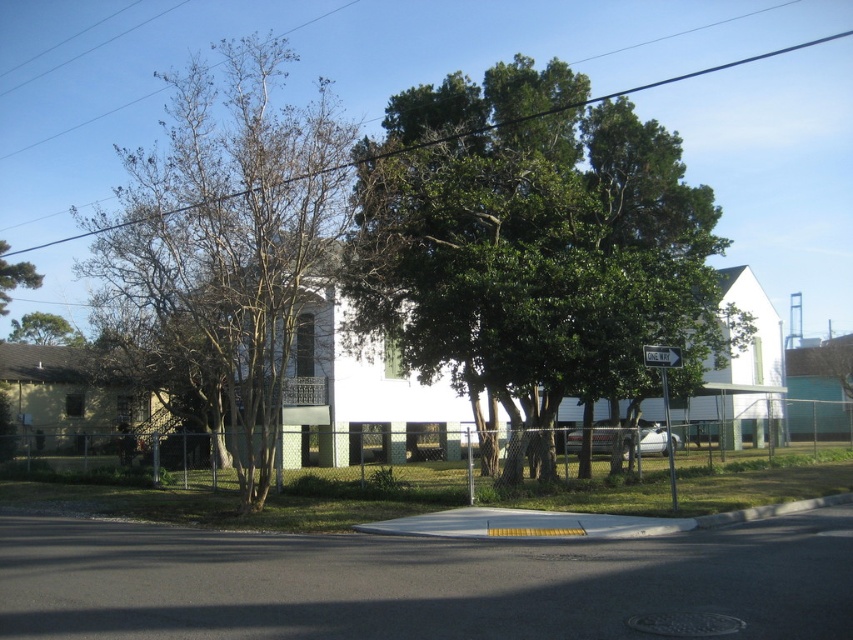
Question: Can you confirm if green leafy tree at center is bigger than black wire at upper center?

Choices:
 (A) yes
 (B) no

Answer: (B)

Question: Which point is farther to the camera?

Choices:
 (A) green leafy tree at upper left
 (B) bare wood tree at left
 (C) green leafy tree at center

Answer: (A)

Question: Among these points, which one is nearest to the camera?

Choices:
 (A) (119, 109)
 (B) (219, 227)
 (C) (660, 141)
 (D) (51, 330)

Answer: (B)

Question: From the image, what is the correct spatial relationship of black wire at upper center in relation to green leafy tree at lower left?

Choices:
 (A) below
 (B) above

Answer: (B)

Question: Among these objects, which one is nearest to the camera?

Choices:
 (A) black wire at upper center
 (B) bare wood tree at left
 (C) green leafy tree at upper left

Answer: (B)

Question: Does green leafy tree at center come behind black wire at upper center?

Choices:
 (A) no
 (B) yes

Answer: (B)